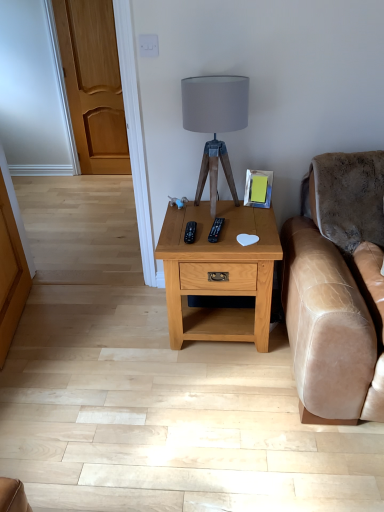
This screenshot has width=384, height=512. I want to click on free point behind black plastic remote at center, the 1th remote in the right-to-left sequence, so click(232, 210).